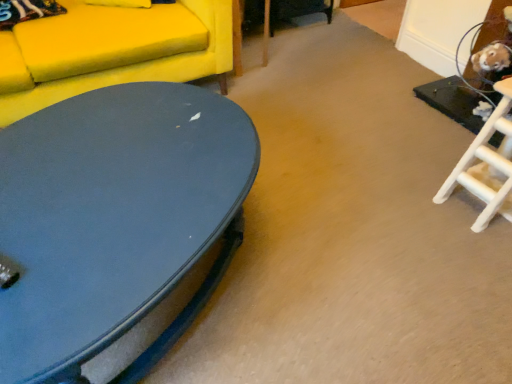
Question: Considering their positions, is matte blue coffee table at lower left located in front of or behind matte yellow fabric couch at upper left?

Choices:
 (A) front
 (B) behind

Answer: (A)

Question: In the image, is matte blue coffee table at lower left on the left side or the right side of matte yellow fabric couch at upper left?

Choices:
 (A) left
 (B) right

Answer: (B)

Question: Is point (28, 213) positioned closer to the camera than point (124, 36)?

Choices:
 (A) farther
 (B) closer

Answer: (B)

Question: In terms of height, does matte yellow fabric couch at upper left look taller or shorter compared to matte blue coffee table at lower left?

Choices:
 (A) short
 (B) tall

Answer: (B)

Question: Relative to matte blue coffee table at lower left, is matte yellow fabric couch at upper left in front or behind?

Choices:
 (A) behind
 (B) front

Answer: (A)

Question: In the image, is matte yellow fabric couch at upper left on the left side or the right side of matte blue coffee table at lower left?

Choices:
 (A) left
 (B) right

Answer: (A)

Question: Is matte yellow fabric couch at upper left wider or thinner than matte blue coffee table at lower left?

Choices:
 (A) thin
 (B) wide

Answer: (B)